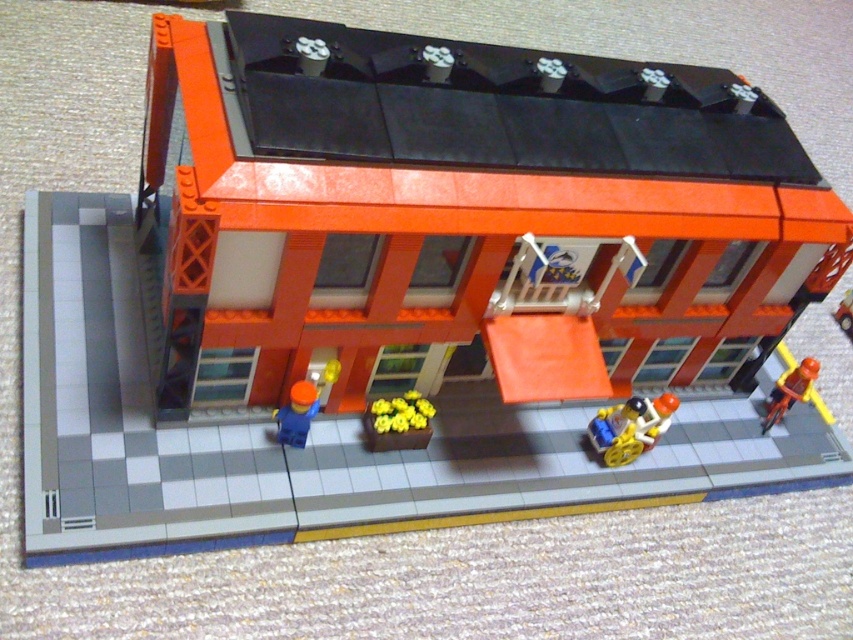
Does translucent yellow plastic cart at lower center come in front of yellow matte flowers at center?

No, it is not.

Does translucent yellow plastic cart at lower center have a larger size compared to yellow matte flowers at center?

Indeed, translucent yellow plastic cart at lower center has a larger size compared to yellow matte flowers at center.

Identify the location of translucent yellow plastic cart at lower center. This screenshot has height=640, width=853. (630, 428).

Is translucent yellow plastic cart at lower center thinner than brick red car at right?

No, translucent yellow plastic cart at lower center is not thinner than brick red car at right.

Does translucent yellow plastic cart at lower center have a greater width compared to brick red car at right?

Indeed, translucent yellow plastic cart at lower center has a greater width compared to brick red car at right.

The height and width of the screenshot is (640, 853). In order to click on translucent yellow plastic cart at lower center in this screenshot , I will do pyautogui.click(x=630, y=428).

Based on the photo, is blue matte figure at center thinner than orange matte bicycle at right?

Correct, blue matte figure at center's width is less than orange matte bicycle at right's.

Who is more forward, (312, 412) or (763, 433)?

Point (312, 412) is more forward.

This screenshot has height=640, width=853. What are the coordinates of `blue matte figure at center` in the screenshot? It's located at (296, 413).